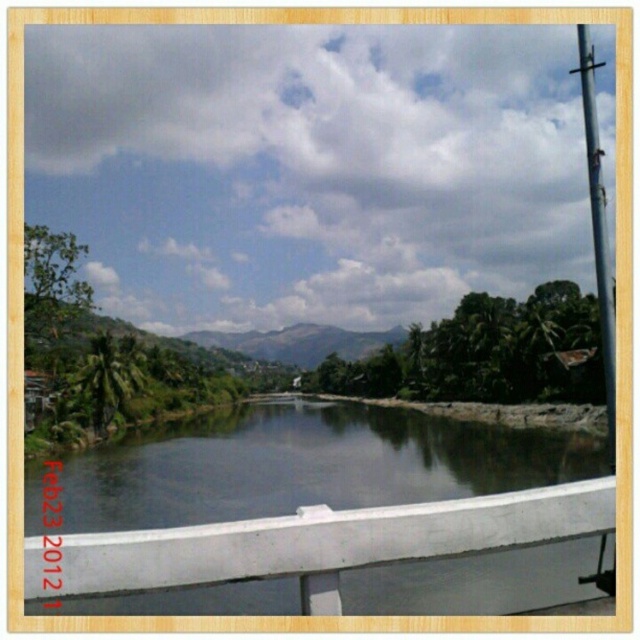
The height and width of the screenshot is (640, 640). Describe the element at coordinates (330, 512) in the screenshot. I see `clear water at center` at that location.

Does clear water at center appear on the left side of metallic pole at right?

Indeed, clear water at center is positioned on the left side of metallic pole at right.

Where is `clear water at center`? The height and width of the screenshot is (640, 640). clear water at center is located at coordinates (330, 512).